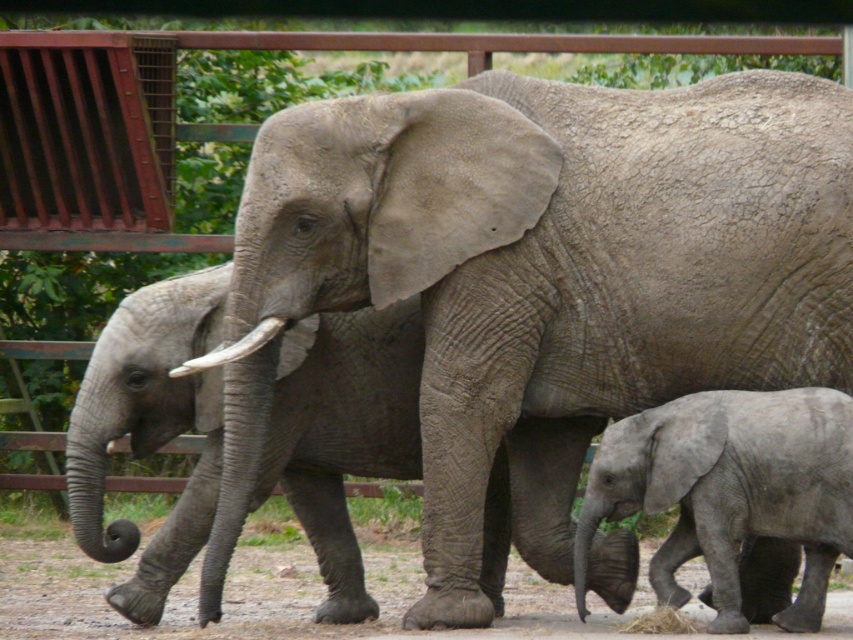
Based on the photo, who is higher up, gray rough elephant at center or gray matte elephant at lower right?

gray rough elephant at center is above.

Is gray rough elephant at center above gray matte elephant at lower right?

Yes.

Is point (292, 298) farther from viewer compared to point (729, 420)?

Yes.

Where is `gray rough elephant at center`? gray rough elephant at center is located at coordinates (540, 282).

Is gray wrinkled elephant at center closer to camera compared to brown dirt field at lower center?

No.

Does gray wrinkled elephant at center appear on the right side of brown dirt field at lower center?

Correct, you'll find gray wrinkled elephant at center to the right of brown dirt field at lower center.

You are a GUI agent. You are given a task and a screenshot of the screen. Output one action in this format:
    pyautogui.click(x=<x>, y=<y>)
    Task: Click on the gray wrinkled elephant at center
    Image resolution: width=853 pixels, height=640 pixels.
    Given the screenshot: What is the action you would take?
    pyautogui.click(x=149, y=428)

Which is more to the right, gray rough elephant at center or brown dirt field at lower center?

gray rough elephant at center is more to the right.

Who is more forward, (566,205) or (97,598)?

Point (566,205) is more forward.

Describe the element at coordinates (540, 282) in the screenshot. I see `gray rough elephant at center` at that location.

Where is `gray rough elephant at center`? The height and width of the screenshot is (640, 853). gray rough elephant at center is located at coordinates (540, 282).